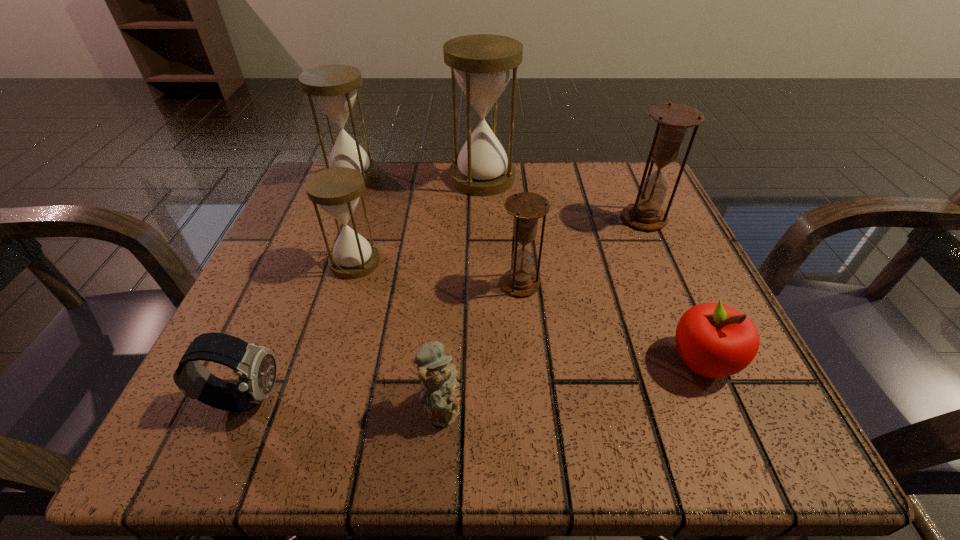
Where is `unoccupied area between the rightmost hourglass and the smallest white hourglass`? unoccupied area between the rightmost hourglass and the smallest white hourglass is located at coordinates (499, 240).

Where is `empty space that is in between the left brown hourglass and the blue teddy bear`? Image resolution: width=960 pixels, height=540 pixels. empty space that is in between the left brown hourglass and the blue teddy bear is located at coordinates (481, 345).

This screenshot has height=540, width=960. In order to click on empty space that is in between the tallest hourglass and the second smallest white hourglass in this screenshot , I will do `click(418, 177)`.

The image size is (960, 540). I want to click on free space between the tallest hourglass and the red apple, so pyautogui.click(x=592, y=269).

The height and width of the screenshot is (540, 960). What are the coordinates of `object that ranks as the closest to the blue teddy bear` in the screenshot? It's located at (520, 280).

Identify which object is the sixth closest to the left brown hourglass. Please provide its 2D coordinates. Your answer should be formatted as a tuple, i.e. [(x, y)], where the tuple contains the x and y coordinates of a point satisfying the conditions above.

[(256, 367)]

What are the coordinates of `the closest hourglass relative to the tallest hourglass` in the screenshot? It's located at (334, 88).

Locate an element on the screen. Image resolution: width=960 pixels, height=540 pixels. hourglass that is the second closest to the teddy bear is located at coordinates (337, 190).

Where is `white hourglass that is the nearest to the rightmost hourglass`? This screenshot has height=540, width=960. white hourglass that is the nearest to the rightmost hourglass is located at coordinates (482, 64).

Point out which white hourglass is positioned as the third nearest to the dark watch. Please provide its 2D coordinates. Your answer should be formatted as a tuple, i.e. [(x, y)], where the tuple contains the x and y coordinates of a point satisfying the conditions above.

[(482, 64)]